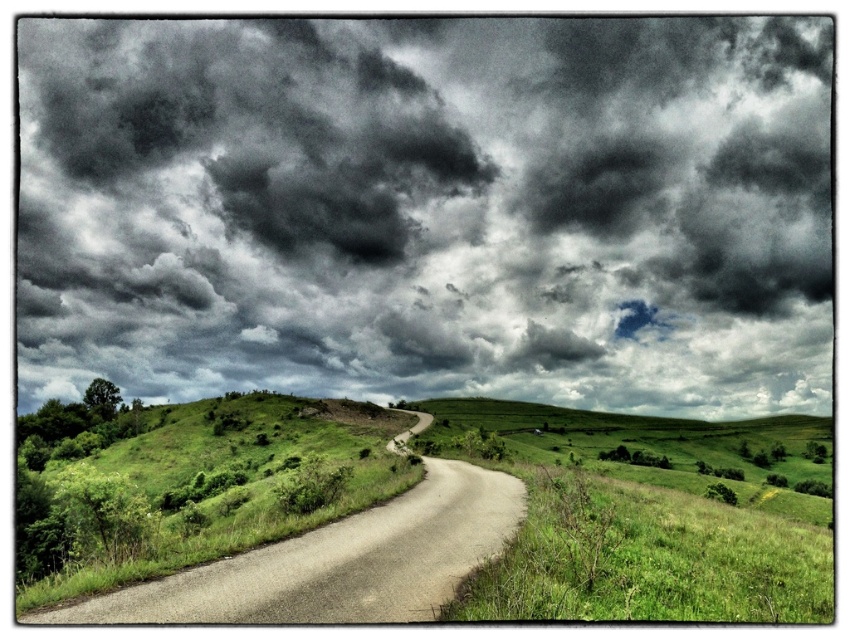
Question: Where is green grassy at lower right located in relation to smooth asphalt road at center in the image?

Choices:
 (A) above
 (B) below

Answer: (B)

Question: Which object is closer to the camera taking this photo?

Choices:
 (A) green grassy at lower right
 (B) smooth asphalt road at center

Answer: (A)

Question: Which point is closer to the camera?

Choices:
 (A) (426, 380)
 (B) (766, 516)
 (C) (384, 605)

Answer: (C)

Question: Which of the following is the farthest from the observer?

Choices:
 (A) dark textured clouds at upper center
 (B) smooth asphalt road at center

Answer: (A)

Question: Can you confirm if dark textured clouds at upper center is wider than green grassy at lower right?

Choices:
 (A) no
 (B) yes

Answer: (B)

Question: Where is dark textured clouds at upper center located in relation to smooth asphalt road at center in the image?

Choices:
 (A) left
 (B) right

Answer: (B)